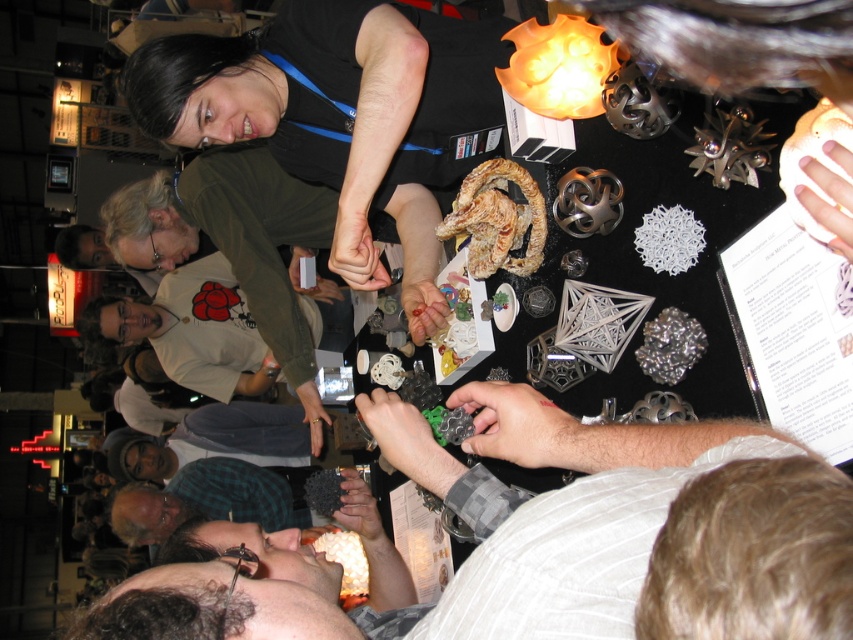
You are standing in front of the table at the convention. You notice two points marked on the table. The first point is at coordinates point (x=462, y=624) and the second is at point (x=253, y=492). Which point is closer to you?

Point (x=462, y=624) is closer to the camera than point (x=253, y=492), so the first point is closer to you.

You are a photographer at the convention. You want to take a photo of the green plaid shirt at lower center without the gray fabric shirt at center blocking it. Is this possible from your current position?

The gray fabric shirt at center is in front of the green plaid shirt at lower center, so it will block the view. Move to a position where the gray fabric shirt at center is not between you and the green plaid shirt at lower center to capture the photo.